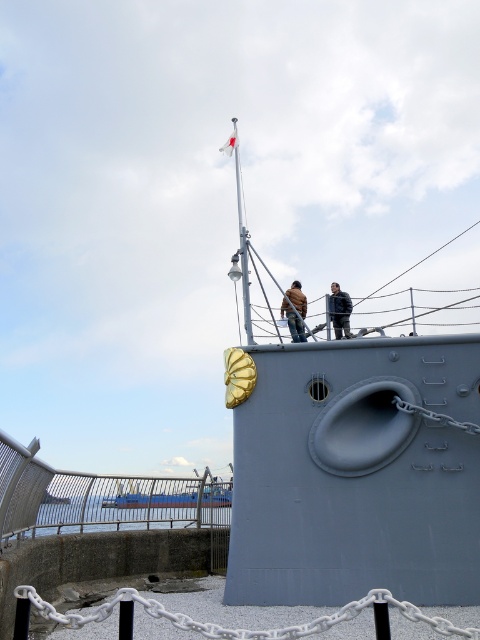
Question: Which object is the closest to the brown leather jacket at upper center?

Choices:
 (A) blue painted metal boat at lower center
 (B) dark blue leather jacket at upper center
 (C) gray metallic boat at center

Answer: (B)

Question: Which point is farther to the camera?

Choices:
 (A) blue painted metal boat at lower center
 (B) brown leather jacket at upper center
 (C) dark blue leather jacket at upper center
 (D) gray metallic boat at center

Answer: (A)

Question: Does gray metallic boat at center come in front of dark blue leather jacket at upper center?

Choices:
 (A) no
 (B) yes

Answer: (B)

Question: Which point is farther from the camera taking this photo?

Choices:
 (A) (264, 365)
 (B) (200, 504)

Answer: (B)

Question: Is gray metallic boat at center wider than blue painted metal boat at lower center?

Choices:
 (A) yes
 (B) no

Answer: (A)

Question: Can you confirm if gray metallic boat at center is positioned to the left of brown leather jacket at upper center?

Choices:
 (A) yes
 (B) no

Answer: (B)